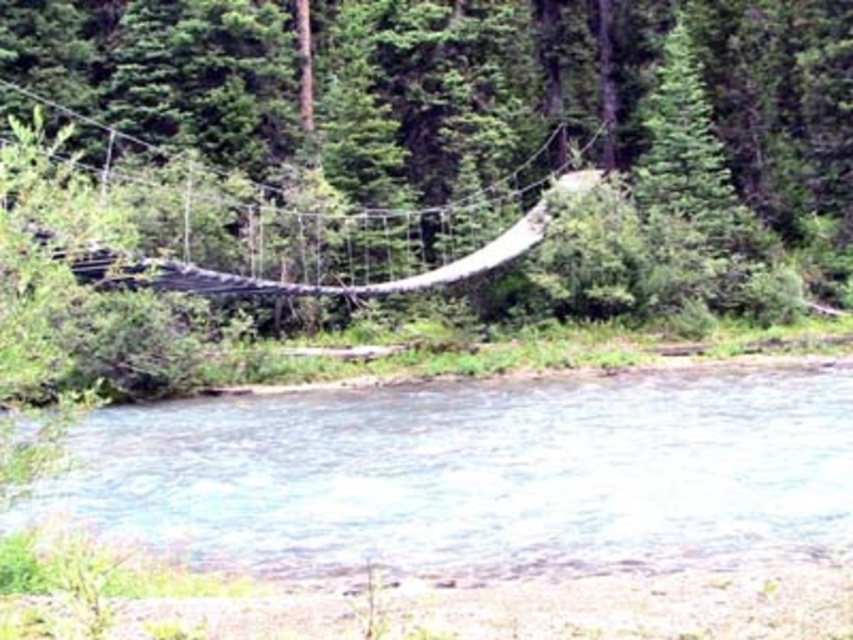
Question: Which of the following is the closest to the observer?

Choices:
 (A) (241, 417)
 (B) (148, 148)

Answer: (A)

Question: Which point is closer to the camera?

Choices:
 (A) clear water at lower center
 (B) green leafy tree at center

Answer: (A)

Question: Can you confirm if green leafy tree at center is positioned to the left of clear water at lower center?

Choices:
 (A) yes
 (B) no

Answer: (A)

Question: Does green leafy tree at center appear on the right side of clear water at lower center?

Choices:
 (A) no
 (B) yes

Answer: (A)

Question: Where is green leafy tree at center located in relation to clear water at lower center in the image?

Choices:
 (A) right
 (B) left

Answer: (B)